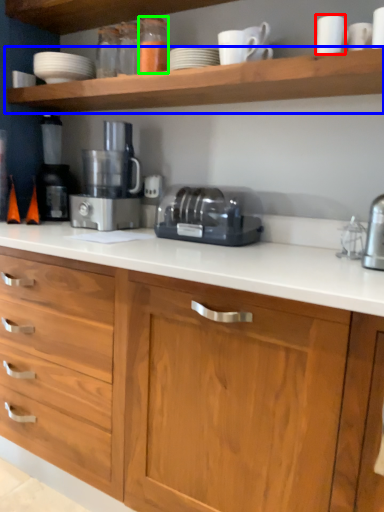
Question: Which object is the farthest from tableware (highlighted by a red box)? Choose among these: shelf (highlighted by a blue box) or bottle (highlighted by a green box).

Choices:
 (A) shelf
 (B) bottle

Answer: (B)